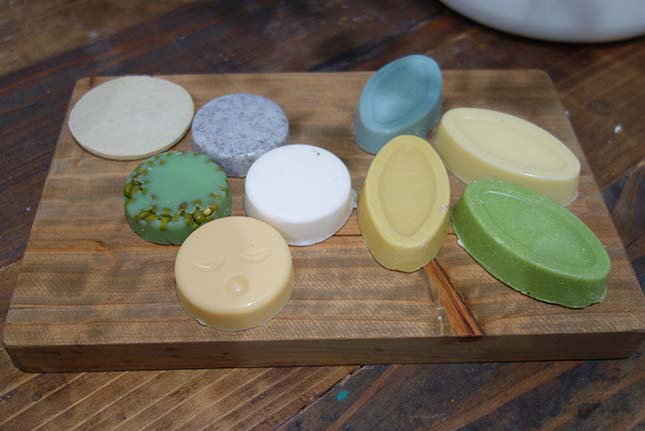
Locate an element on the screen. The width and height of the screenshot is (645, 431). tabletop is located at coordinates (222, 390).